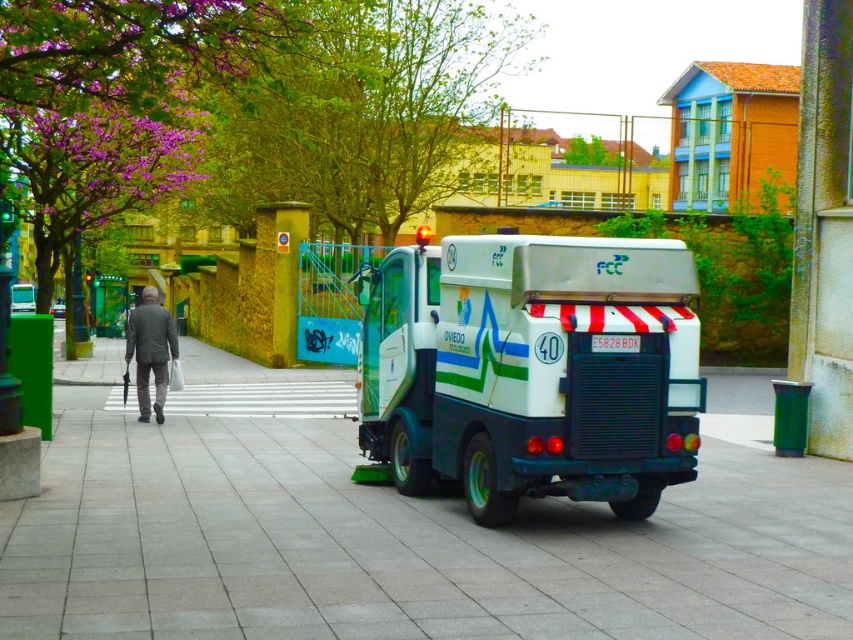
Can you confirm if dark gray suit at left is positioned below white matte street sweeper at center?

Yes.

Who is taller, dark gray suit at left or white matte street sweeper at center?

dark gray suit at left is taller.

Who is more forward, [167,371] or [54,314]?

Point [167,371] is in front.

Image resolution: width=853 pixels, height=640 pixels. Identify the location of dark gray suit at left. (149, 349).

Who is more distant from viewer, (x=62, y=576) or (x=57, y=305)?

The point (x=57, y=305) is behind.

Consider the image. Between green tile pavement at center and white matte street sweeper at center, which one appears on the left side from the viewer's perspective?

Positioned to the left is white matte street sweeper at center.

Image resolution: width=853 pixels, height=640 pixels. Find the location of `green tile pavement at center`. green tile pavement at center is located at coordinates coord(393,532).

Does point (134, 333) come closer to viewer compared to point (27, 282)?

Yes, point (134, 333) is closer to viewer.

Can you confirm if dark gray suit at left is thinner than white matte bus at center?

In fact, dark gray suit at left might be wider than white matte bus at center.

Measure the distance between dark gray suit at left and camera.

12.07 meters

Find the location of a particular element. The image size is (853, 640). dark gray suit at left is located at coordinates (149, 349).